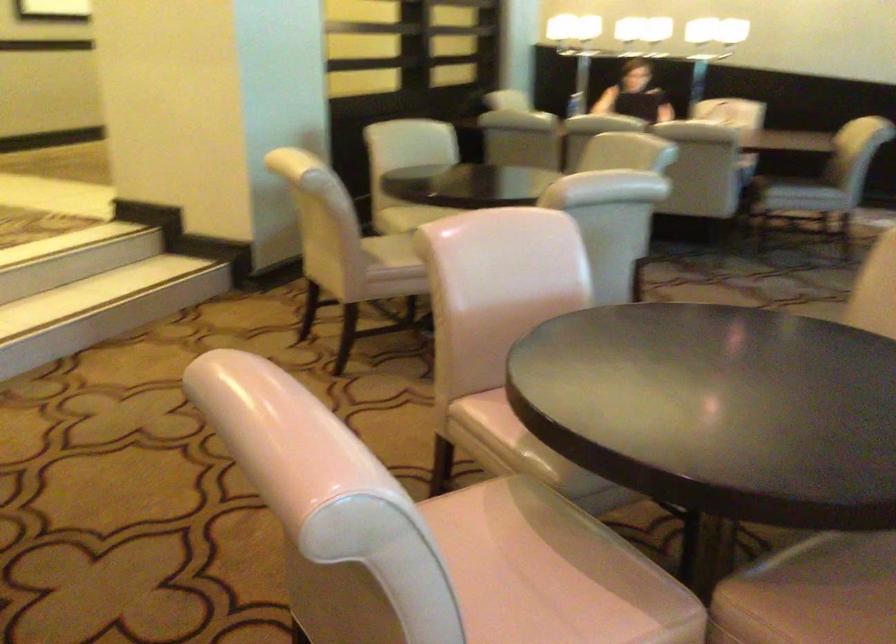
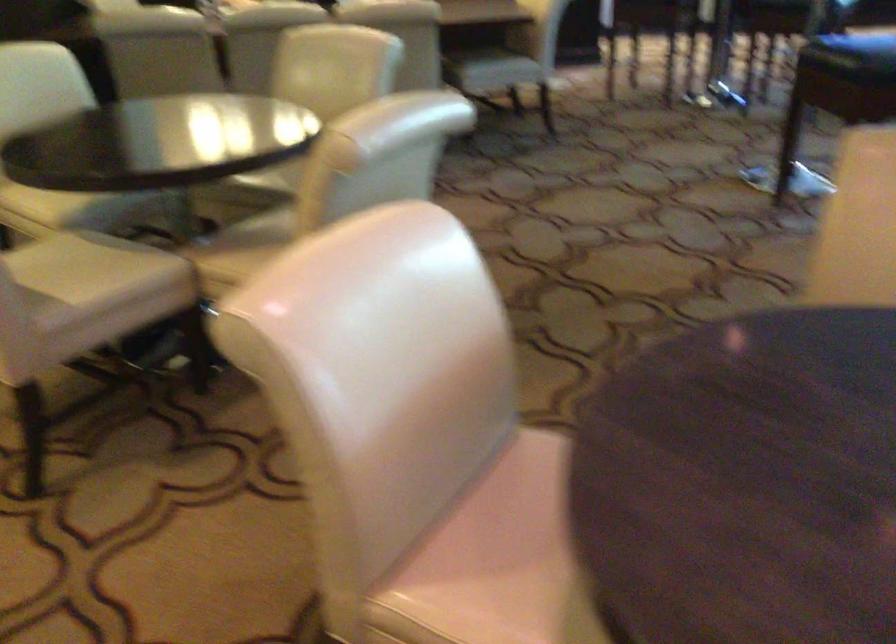
Locate, in the second image, the point that corresponds to [504,410] in the first image.

(488, 597)